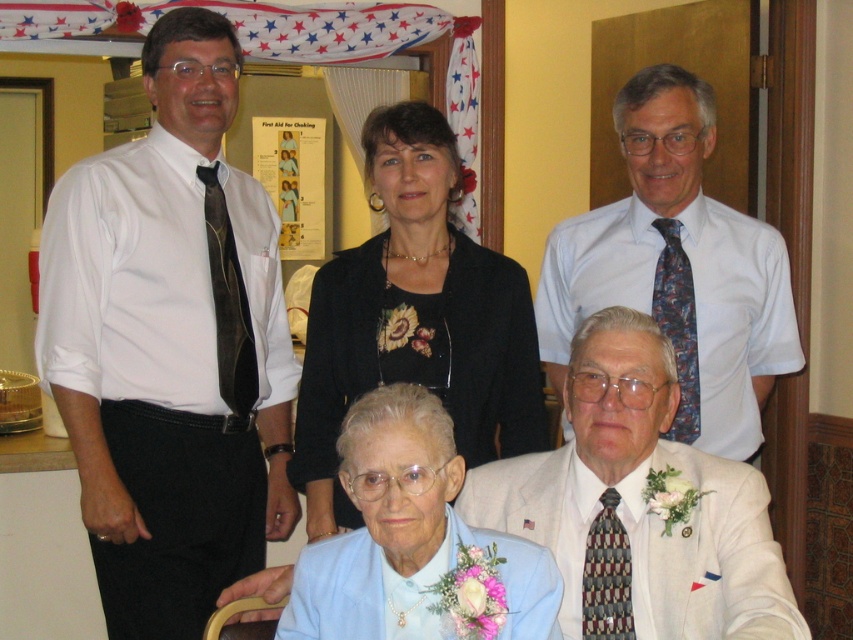
Can you confirm if white textured suit at lower right is taller than blue patterned tie at right?

Correct, white textured suit at lower right is much taller as blue patterned tie at right.

Does point (619, 531) come closer to viewer compared to point (660, 284)?

Yes.

Measure the distance between point (x=732, y=492) and camera.

1.92 meters

Where is `white textured suit at lower right`? The width and height of the screenshot is (853, 640). white textured suit at lower right is located at coordinates (639, 506).

Is light blue fabric at lower center in front of brown textured tie at left?

That is True.

Does light blue fabric at lower center come behind brown textured tie at left?

No, light blue fabric at lower center is in front of brown textured tie at left.

Between point (357, 426) and point (242, 328), which one is positioned behind?

Positioned behind is point (242, 328).

The height and width of the screenshot is (640, 853). I want to click on light blue fabric at lower center, so click(405, 532).

Who is more distant from viewer, (335, 579) or (683, 337)?

The point (683, 337) is more distant.

At what (x,y) coordinates should I click in order to perform the action: click on light blue fabric at lower center. Please return your answer as a coordinate pair (x, y). Looking at the image, I should click on (405, 532).